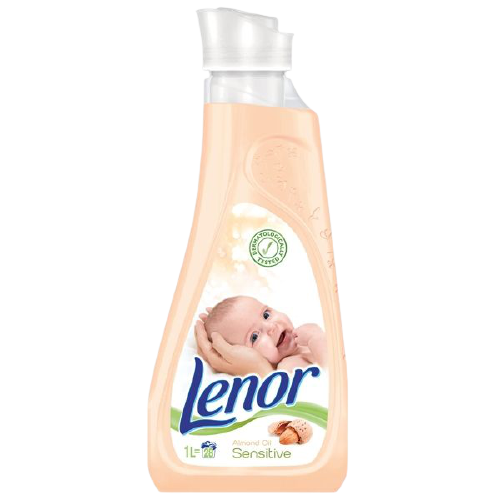
Locate an element on the screen. Image resolution: width=500 pixels, height=500 pixels. soap is located at coordinates (223, 122).